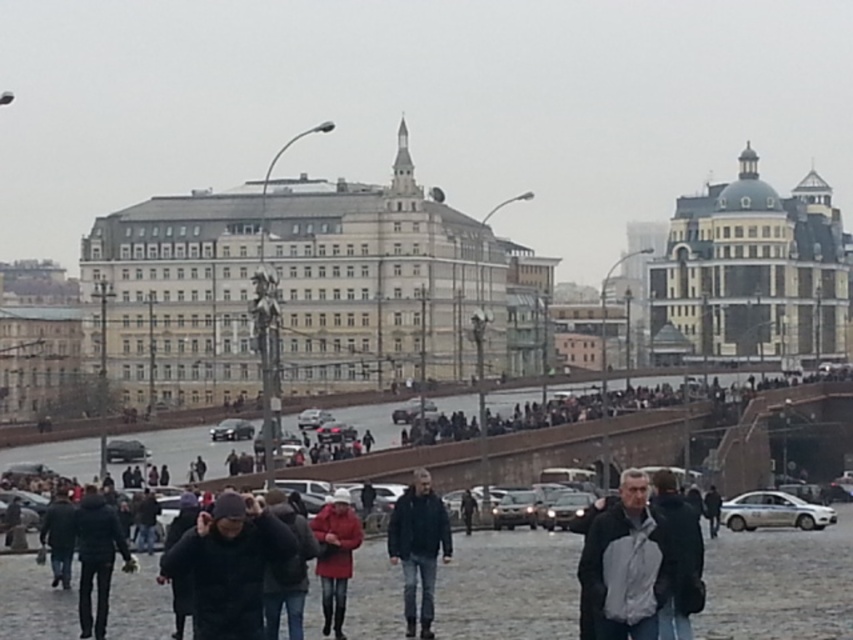
Measure the distance from dark gray jacket at lower left to matte red coat at center.

dark gray jacket at lower left and matte red coat at center are 6.98 meters apart.

Is dark gray jacket at lower left positioned at the back of matte red coat at center?

Yes.

Who is more forward, (126, 554) or (340, 616)?

Point (340, 616) is more forward.

The height and width of the screenshot is (640, 853). I want to click on dark gray jacket at lower left, so click(x=96, y=557).

Does gray fabric jacket at center have a larger size compared to dark gray jacket at lower left?

No.

Can you confirm if gray fabric jacket at center is positioned to the right of dark gray jacket at lower left?

Indeed, gray fabric jacket at center is positioned on the right side of dark gray jacket at lower left.

Who is more distant from viewer, (653, 547) or (76, 518)?

The point (76, 518) is more distant.

Where is `gray fabric jacket at center`? gray fabric jacket at center is located at coordinates (625, 564).

Between dark gray knit cap at center and dark blue jacket at center, which one is positioned lower?

Positioned lower is dark blue jacket at center.

Is point (215, 556) less distant than point (425, 589)?

Yes, point (215, 556) is closer to viewer.

Describe the element at coordinates (228, 564) in the screenshot. I see `dark gray knit cap at center` at that location.

Find the location of a particular element. Image resolution: width=853 pixels, height=640 pixels. dark gray knit cap at center is located at coordinates (228, 564).